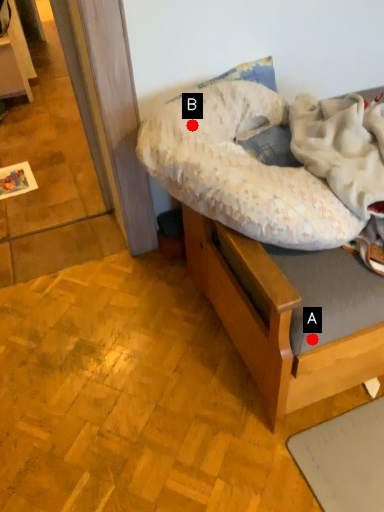
Question: Two points are circled on the image, labeled by A and B beside each circle. Which point appears farthest from the camera in this image?

Choices:
 (A) A is further
 (B) B is further

Answer: (B)